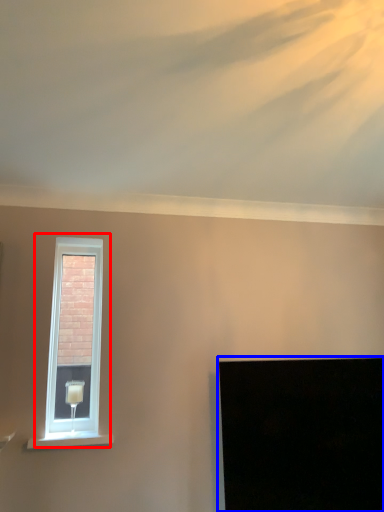
Question: Which object is closer to the camera taking this photo, window (highlighted by a red box) or computer screen (highlighted by a blue box)?

Choices:
 (A) window
 (B) computer screen

Answer: (B)